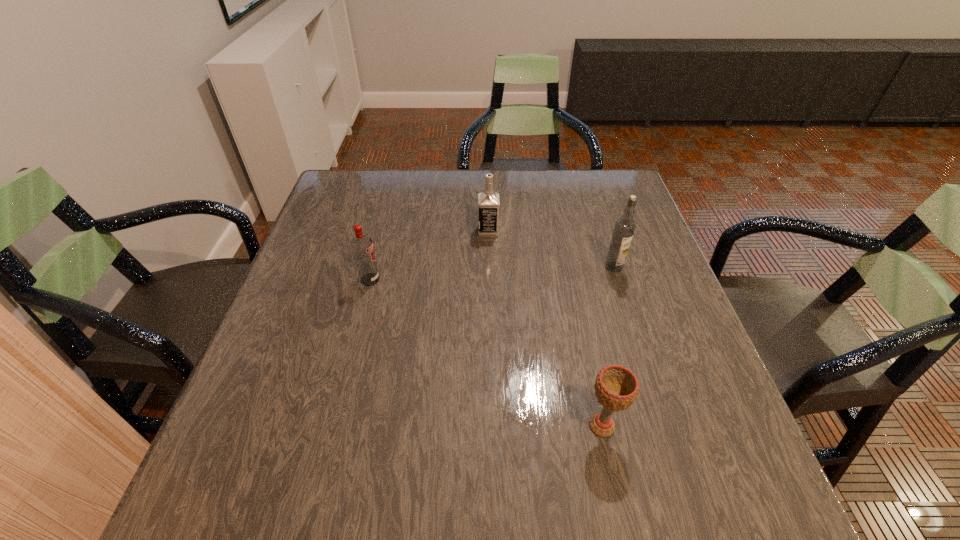
Where is `unoccupied area between the chalice and the leftmost object`? The height and width of the screenshot is (540, 960). unoccupied area between the chalice and the leftmost object is located at coordinates (486, 353).

Locate an element on the screen. This screenshot has height=540, width=960. object that is the second closest to the tallest vodka is located at coordinates (616, 387).

Identify which object is the second closest to the nearest object. Please provide its 2D coordinates. Your answer should be formatted as a tuple, i.e. [(x, y)], where the tuple contains the x and y coordinates of a point satisfying the conditions above.

[(488, 202)]

This screenshot has height=540, width=960. Identify the location of vodka that stands as the closest to the farthest vodka. (362, 248).

Where is `vodka that is the third closest to the nearest object`? This screenshot has height=540, width=960. vodka that is the third closest to the nearest object is located at coordinates (362, 248).

At what (x,y) coordinates should I click in order to perform the action: click on free space that satisfies the following two spatial constraints: 1. on the front label of the leftmost vodka; 2. on the right side of the third object from left to right. Please return your answer as a coordinate pair (x, y). Looking at the image, I should click on (332, 426).

The image size is (960, 540). I want to click on free location that satisfies the following two spatial constraints: 1. on the label of the tallest vodka; 2. on the front label of the leftmost vodka, so click(x=618, y=279).

This screenshot has height=540, width=960. I want to click on vacant space that satisfies the following two spatial constraints: 1. on the front label of the leftmost vodka; 2. on the right side of the third object from left to right, so click(332, 426).

This screenshot has height=540, width=960. Find the location of `vacant space that satisfies the following two spatial constraints: 1. on the front label of the third object from left to right; 2. on the right side of the leftmost vodka`. vacant space that satisfies the following two spatial constraints: 1. on the front label of the third object from left to right; 2. on the right side of the leftmost vodka is located at coordinates (332, 426).

Find the location of a particular element. vacant space that satisfies the following two spatial constraints: 1. on the label of the rightmost object; 2. on the front label of the leftmost vodka is located at coordinates (618, 279).